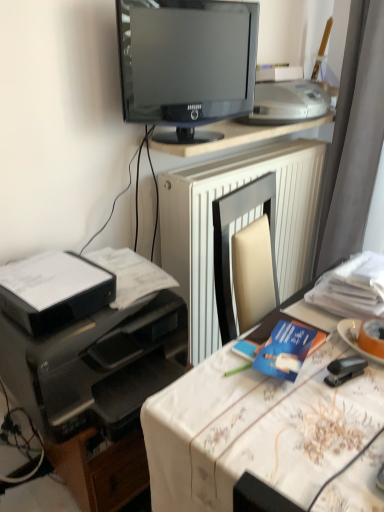
Find the location of `free spot above black plastic printer at left, arranged as the third printer when viewed from the top (from a real-world perspective)`. free spot above black plastic printer at left, arranged as the third printer when viewed from the top (from a real-world perspective) is located at coordinates (115, 285).